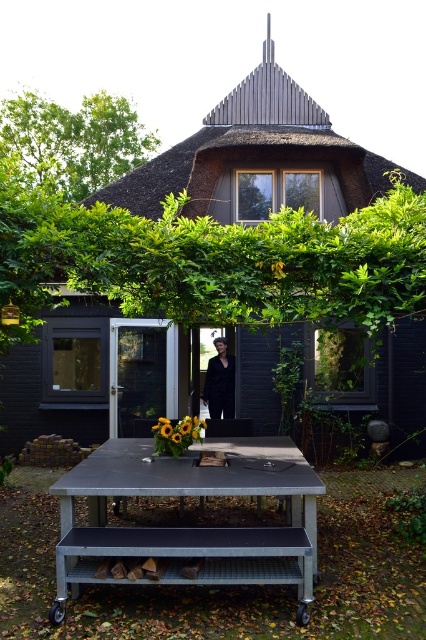
Which is behind, point (40, 387) or point (255, 538)?

The point (40, 387) is behind.

Between point (284, 138) and point (204, 534), which one is positioned behind?

The point (284, 138) is behind.

This screenshot has height=640, width=426. Identify the location of black wood hut at center. (258, 156).

Does black wood hut at center appear on the right side of black fabric at center?

Correct, you'll find black wood hut at center to the right of black fabric at center.

Who is more distant from viewer, (x=146, y=196) or (x=212, y=358)?

Point (x=212, y=358)

At what (x,y) coordinates should I click in order to perform the action: click on black wood hut at center. Please return your answer as a coordinate pair (x, y). Looking at the image, I should click on (x=258, y=156).

Locate an element on the screen. Image resolution: width=426 pixels, height=640 pixels. black wood hut at center is located at coordinates (258, 156).

Does metallic gray table at center appear under black fabric at center?

Correct, metallic gray table at center is located below black fabric at center.

In the scene shown: Is metallic gray table at center further to camera compared to black fabric at center?

That is False.

Which is behind, point (143, 556) or point (233, 416)?

The point (233, 416) is behind.

Identify the location of metallic gray table at center. The height and width of the screenshot is (640, 426). (187, 528).